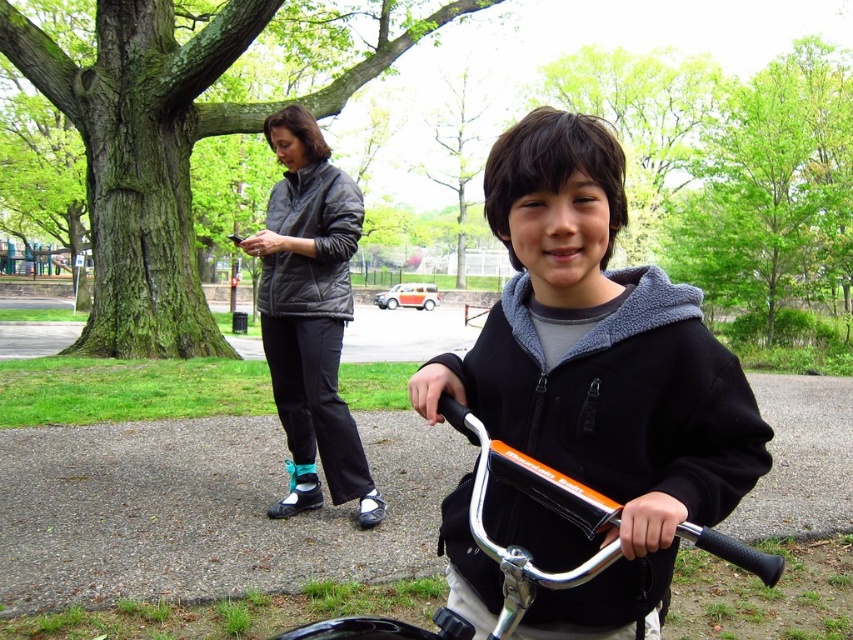
Question: Where is black fleece jacket at center located in relation to matte black jacket at upper center in the image?

Choices:
 (A) right
 (B) left

Answer: (A)

Question: Does black fleece jacket at center have a larger size compared to matte black jacket at upper center?

Choices:
 (A) no
 (B) yes

Answer: (B)

Question: Which object appears closest to the camera in this image?

Choices:
 (A) matte black jacket at upper center
 (B) orange metallic bicycle handlebars at center
 (C) black fleece jacket at center
 (D) matte black jacket at upper left

Answer: (B)

Question: Which point is closer to the camera?

Choices:
 (A) matte black jacket at upper center
 (B) matte black jacket at upper left

Answer: (B)

Question: Is the position of black fleece jacket at center more distant than that of matte black jacket at upper left?

Choices:
 (A) yes
 (B) no

Answer: (B)

Question: Among these objects, which one is farthest from the camera?

Choices:
 (A) matte black jacket at upper center
 (B) matte black jacket at upper left
 (C) black fleece jacket at center

Answer: (A)